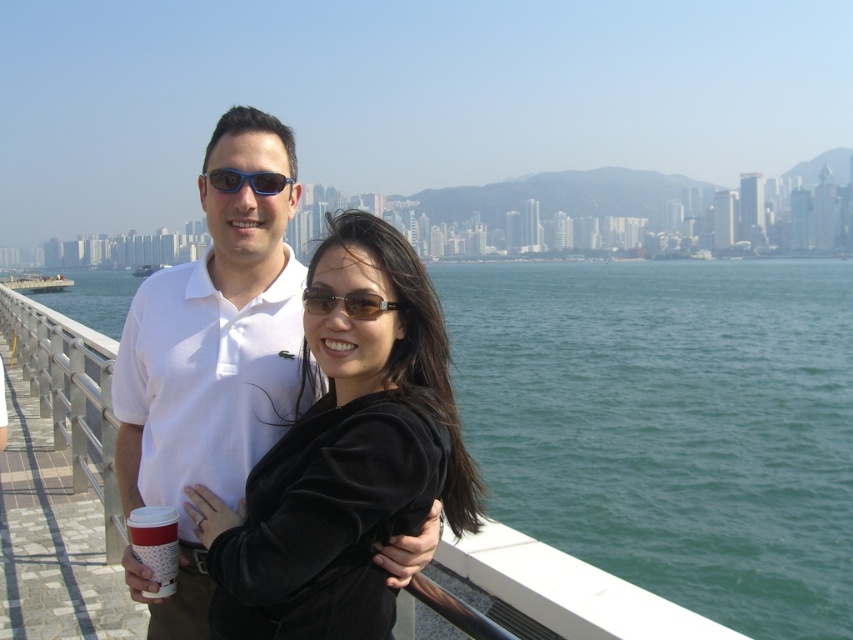
Can you confirm if white cotton polo shirt at center is taller than brown matte sunglasses at center?

Yes.

Who is lower down, white cotton polo shirt at center or brown matte sunglasses at center?

brown matte sunglasses at center is lower down.

This screenshot has height=640, width=853. Find the location of `white cotton polo shirt at center`. white cotton polo shirt at center is located at coordinates (215, 333).

The height and width of the screenshot is (640, 853). What do you see at coordinates (671, 424) in the screenshot? I see `green water at center` at bounding box center [671, 424].

Can you confirm if green water at center is shorter than black velvet jacket at center?

Incorrect, green water at center's height does not fall short of black velvet jacket at center's.

Is point (669, 426) farther from camera compared to point (248, 509)?

Yes.

The height and width of the screenshot is (640, 853). I want to click on green water at center, so click(x=671, y=424).

Is green water at center positioned before white paper cup at lower left?

No, green water at center is further to the viewer.

Is green water at center thinner than white paper cup at lower left?

In fact, green water at center might be wider than white paper cup at lower left.

Locate an element on the screen. The height and width of the screenshot is (640, 853). green water at center is located at coordinates (671, 424).

Where is `green water at center`? The height and width of the screenshot is (640, 853). green water at center is located at coordinates (671, 424).